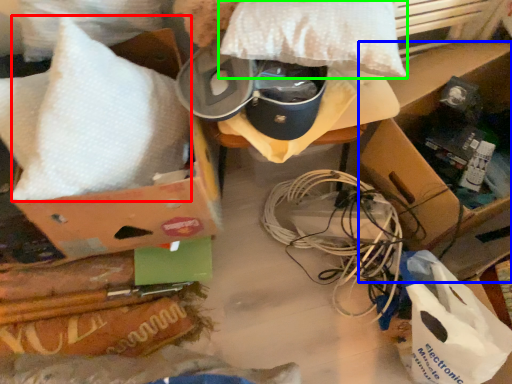
Question: Which is farther away from pillow (highlighted by a red box)? cardboard box (highlighted by a blue box) or pillow (highlighted by a green box)?

Choices:
 (A) cardboard box
 (B) pillow

Answer: (A)